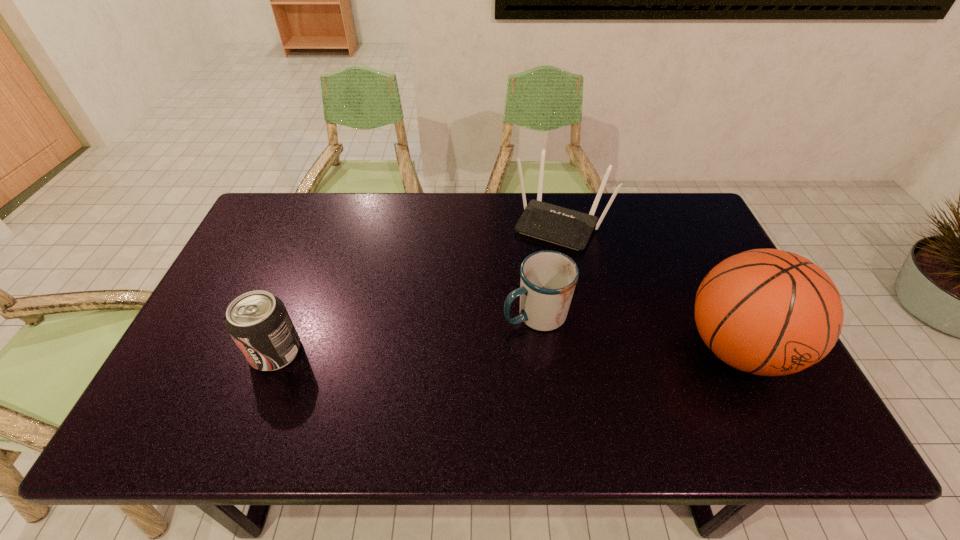
Locate an element on the screen. The height and width of the screenshot is (540, 960). vacant area at the far edge of the desktop is located at coordinates (442, 200).

Where is `free spot at the near edge of the desktop`? The image size is (960, 540). free spot at the near edge of the desktop is located at coordinates (301, 379).

Locate an element on the screen. The width and height of the screenshot is (960, 540). vacant space at the left edge of the desktop is located at coordinates [x=232, y=354].

Identify the location of free space at the right edge. The image size is (960, 540). (683, 286).

At what (x,y) coordinates should I click in order to perform the action: click on free space at the far left corner of the desktop. Please return your answer as a coordinate pair (x, y). This screenshot has height=540, width=960. Looking at the image, I should click on (279, 206).

At what (x,y) coordinates should I click in order to perform the action: click on vacant space at the near left corner. Please return your answer as a coordinate pair (x, y). Looking at the image, I should click on (189, 397).

At what (x,y) coordinates should I click in order to perform the action: click on vacant region at the far right corner of the desktop. Please return your answer as a coordinate pair (x, y). Looking at the image, I should click on (675, 230).

I want to click on free space at the near right corner of the desktop, so click(768, 391).

Locate an element on the screen. Image resolution: width=960 pixels, height=540 pixels. empty space that is in between the farthest object and the basketball is located at coordinates (649, 286).

The height and width of the screenshot is (540, 960). Find the location of `blank region between the tallest object and the mug`. blank region between the tallest object and the mug is located at coordinates (636, 331).